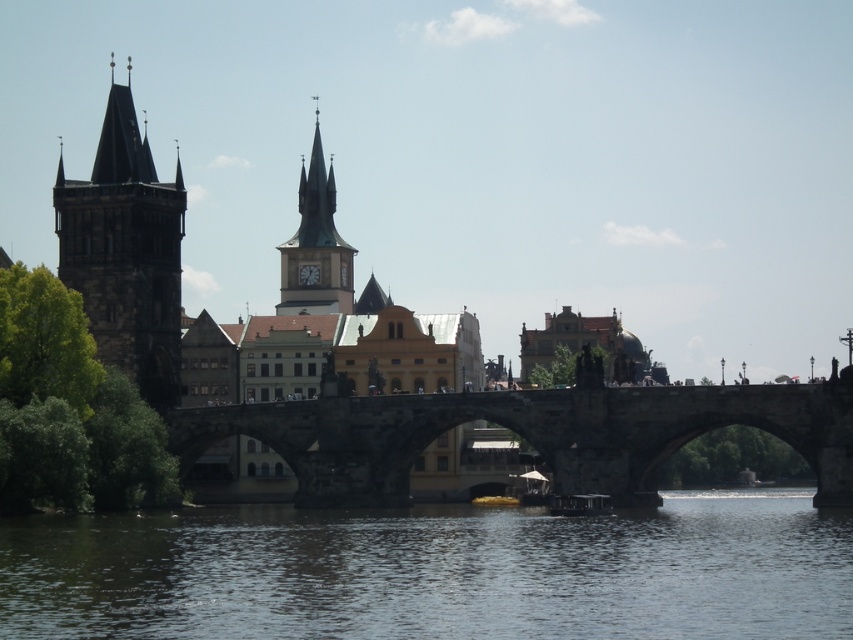
You are an architect visiting Prague and want to take a photo of the brown stone bridge at center and the dark stone tower at left. Which object should you focus on first if you want to capture both in a single frame without moving the camera?

The brown stone bridge at center is larger in size than the dark stone tower at left, so you should focus on the brown stone bridge at center first to ensure it fits properly in the frame before adjusting for the smaller dark stone tower at left.

You are a tourist standing on Charles Bridge and want to take a photo that includes both the dark stone tower at left and the smooth stone clock tower at center. If your camera can capture a maximum distance of 50 meters between the nearest and farthest objects in focus, will both towers be in focus in the photo?

The dark stone tower at left and smooth stone clock tower at center are 49.33 meters apart from each other. Since the distance between them is less than the camera maximum of 50 meters, both towers will be in focus in the photo.

You are a tourist standing on Charles Bridge and want to take a photo that includes both the dark stone tower at left and the smooth stone clock tower at center. Which tower should you position closer to the left side of your camera frame to capture both in the shot?

You should position the dark stone tower at left closer to the left side of your camera frame since it is already to the left of the smooth stone clock tower at center, ensuring both are included in the photo.